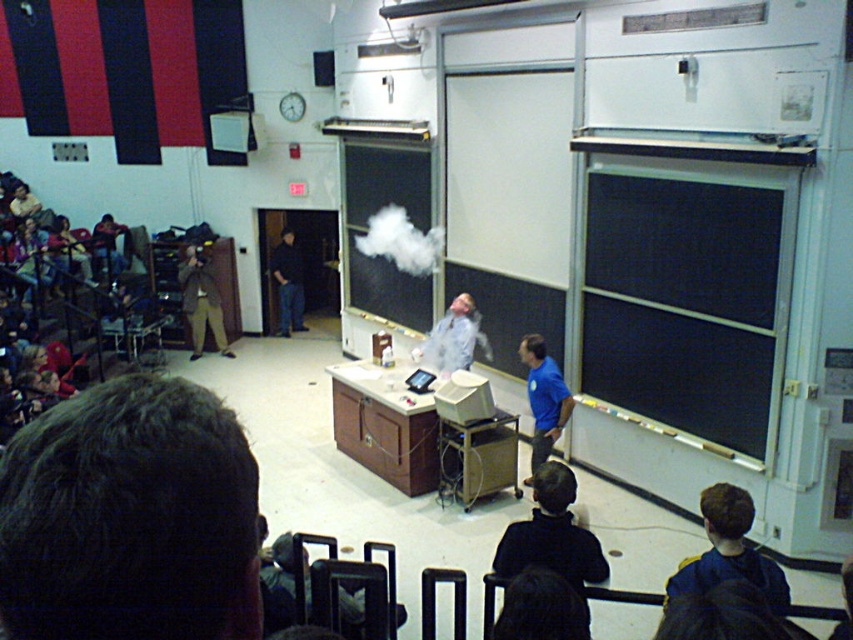
Who is taller, black matte projection screen at right or white smoke at center?

With more height is black matte projection screen at right.

What do you see at coordinates (683, 304) in the screenshot? I see `black matte projection screen at right` at bounding box center [683, 304].

Between point (596, 285) and point (368, 232), which one is positioned in front?

Positioned in front is point (596, 285).

You are a GUI agent. You are given a task and a screenshot of the screen. Output one action in this format:
    pyautogui.click(x=<x>, y=<y>)
    Task: Click on the black matte projection screen at right
    The width and height of the screenshot is (853, 640).
    Given the screenshot: What is the action you would take?
    click(x=683, y=304)

Who is positioned more to the left, white smoke at center or dark blue jeans at center?

Positioned to the left is dark blue jeans at center.

Does white smoke at center have a smaller size compared to dark blue jeans at center?

Actually, white smoke at center might be larger than dark blue jeans at center.

Is point (405, 250) more distant than point (286, 328)?

No, it is not.

Identify the location of white smoke at center. This screenshot has height=640, width=853. (401, 241).

Is black matte projection screen at right positioned in front of white matte cloud at center?

Yes, it is.

Can you confirm if black matte projection screen at right is positioned above white matte cloud at center?

Incorrect, black matte projection screen at right is not positioned above white matte cloud at center.

Is point (654, 269) in front of point (345, 272)?

That is True.

The image size is (853, 640). What are the coordinates of `black matte projection screen at right` in the screenshot? It's located at (683, 304).